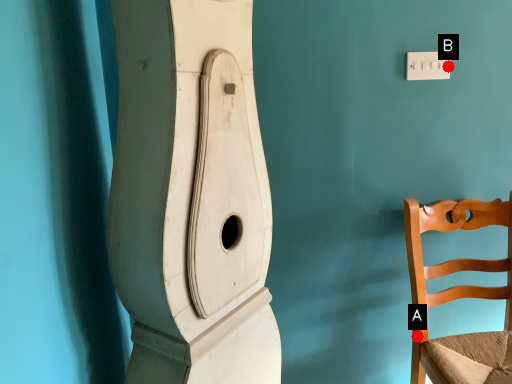
Question: Two points are circled on the image, labeled by A and B beside each circle. Which point appears closest to the camera in this image?

Choices:
 (A) A is closer
 (B) B is closer

Answer: (B)